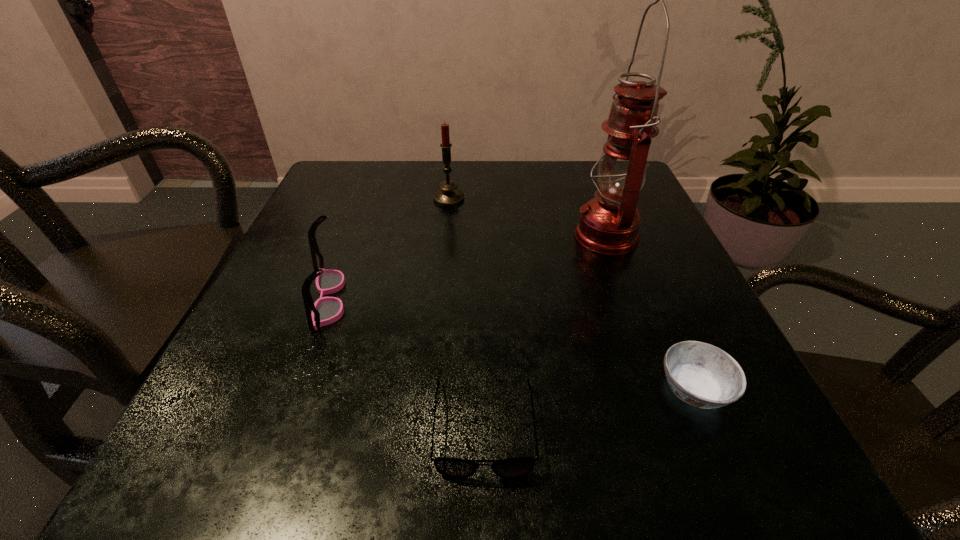
Identify which object is the closest to the farther spectacles. Please provide its 2D coordinates. Your answer should be formatted as a tuple, i.e. [(x, y)], where the tuple contains the x and y coordinates of a point satisfying the conditions above.

[(455, 468)]